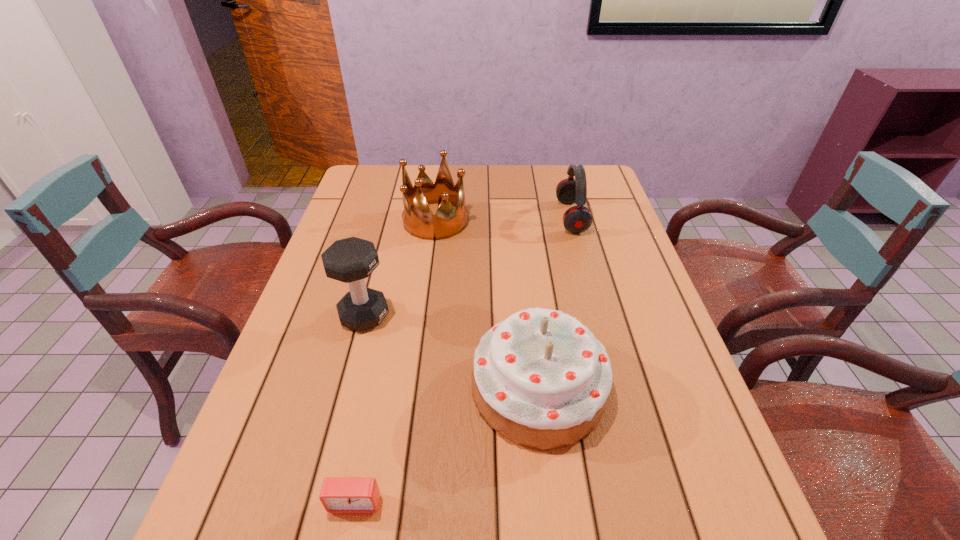
In order to click on vacant region between the cake and the earphone in this screenshot , I will do `click(555, 303)`.

This screenshot has width=960, height=540. I want to click on blank region between the crown and the earphone, so click(x=503, y=219).

This screenshot has width=960, height=540. What are the coordinates of `free space that is in between the crown and the second nearest object` in the screenshot? It's located at (487, 305).

Where is `vacant area between the earphone and the second nearest object`? The height and width of the screenshot is (540, 960). vacant area between the earphone and the second nearest object is located at coordinates pyautogui.click(x=555, y=303).

Identify the location of empty location between the crown and the earphone. (503, 219).

Locate an element on the screen. This screenshot has width=960, height=540. vacant region between the crown and the second nearest object is located at coordinates (487, 305).

Locate an element on the screen. free point between the nearest object and the second nearest object is located at coordinates (446, 445).

Identify the location of free space that is in between the crown and the third farthest object. Image resolution: width=960 pixels, height=540 pixels. (400, 268).

Find the location of a particular element. The height and width of the screenshot is (540, 960). vacant point located between the second nearest object and the dumbbell is located at coordinates (451, 352).

You are a GUI agent. You are given a task and a screenshot of the screen. Output one action in this format:
    pyautogui.click(x=<x>, y=<y>)
    Task: Click on the blank region between the earphone and the cake
    The height and width of the screenshot is (540, 960).
    Given the screenshot: What is the action you would take?
    pyautogui.click(x=555, y=303)